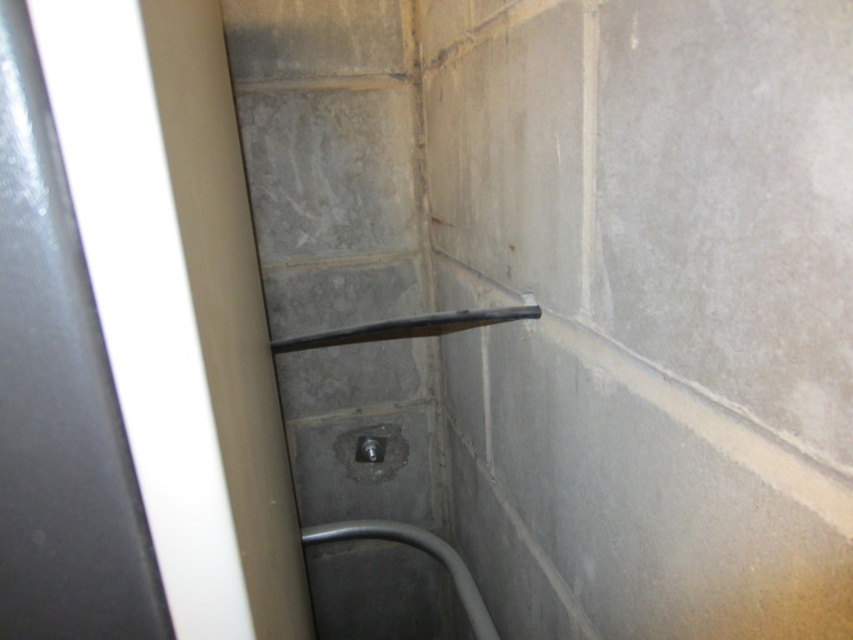
Can you confirm if black rubber shower at center is thinner than satin silver drain at center?

In fact, black rubber shower at center might be wider than satin silver drain at center.

Does black rubber shower at center have a lesser height compared to satin silver drain at center?

Indeed, black rubber shower at center has a lesser height compared to satin silver drain at center.

Find the location of a particular element. black rubber shower at center is located at coordinates (409, 326).

Find the location of `black rubber shower at center`. black rubber shower at center is located at coordinates (409, 326).